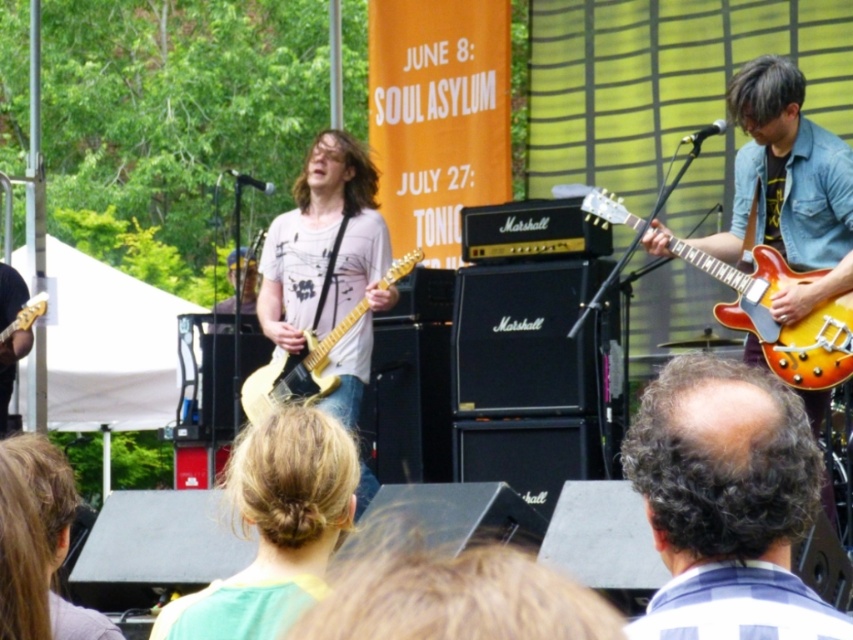
You are a photographer trying to capture the two musicians on stage. You notice the dark brown curly hair at center and the blonde hair at center. Which musician would you focus on if you want to capture the one with more visible hair?

The blonde hair at center occupies more space than dark brown curly hair at center, so focusing on the blonde hair at center would capture the musician with more visible hair.

You are a photographer at the concert. You need to capture a closeup of the sunburst wood electric guitar at right. The camera you have can only focus on objects within a 0.1 unit radius from the point specified. Is the point at (x=776, y=321) suitable for focusing on the sunburst wood electric guitar at right?

The point at (x=776, y=321) indicates the sunburst wood electric guitar at right, so yes, the point is suitable for focusing on the sunburst wood electric guitar at right as it directly corresponds to its location.